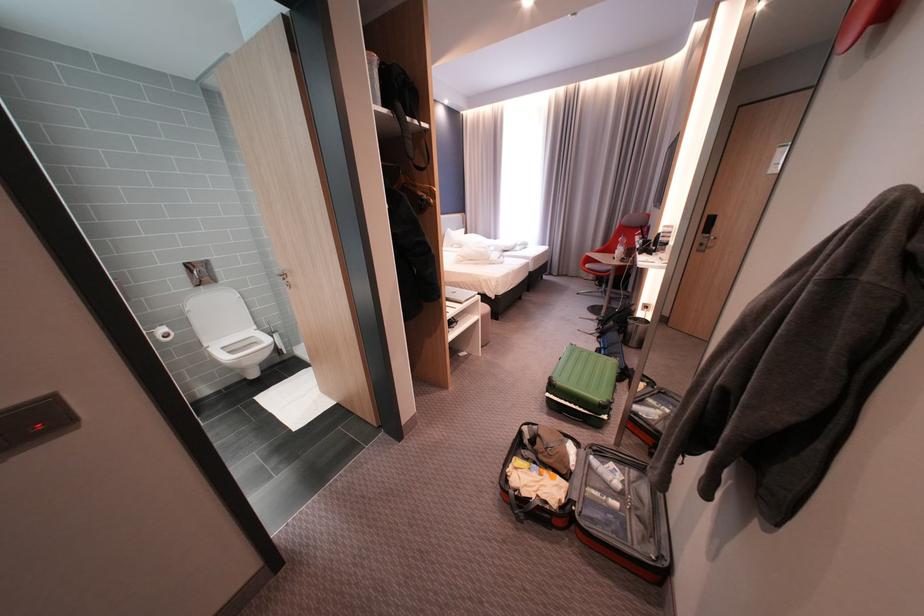
Image resolution: width=924 pixels, height=616 pixels. Identify the location of toilet flush plate. (275, 339).